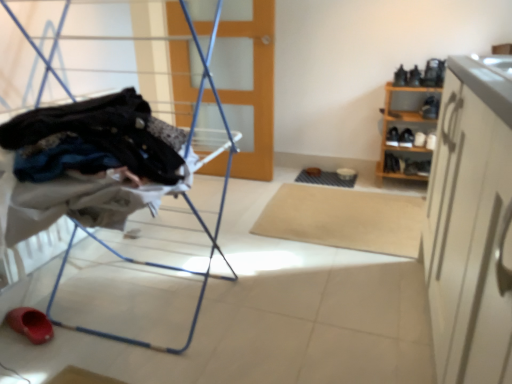
This screenshot has width=512, height=384. I want to click on free location in front of rubber/soft sole shoe at lower left, so click(x=24, y=352).